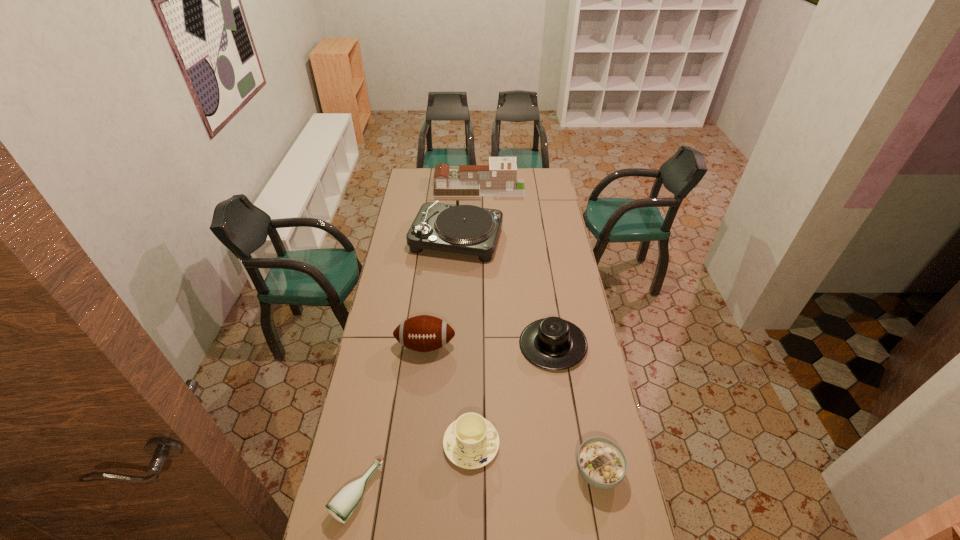
Identify the location of the farthest object. The width and height of the screenshot is (960, 540). (498, 179).

Where is `the tallest object`? The image size is (960, 540). the tallest object is located at coordinates (498, 179).

At what (x,y) coordinates should I click in order to perform the action: click on record player. Please return your answer as a coordinate pair (x, y). This screenshot has width=960, height=540. Looking at the image, I should click on (466, 229).

You are a GUI agent. You are given a task and a screenshot of the screen. Output one action in this format:
    pyautogui.click(x=<x>, y=<y>)
    Task: Click on the football
    
    Given the screenshot: What is the action you would take?
    pyautogui.click(x=423, y=333)

Identify the location of dress hat. The width and height of the screenshot is (960, 540). (552, 343).

Identify the location of chinaware. (470, 442).

Locate an element on the screen. This screenshot has width=960, height=540. the second shortest object is located at coordinates (601, 462).

Identify the location of bottle. The width and height of the screenshot is (960, 540). (342, 505).

Locate an element on the screen. This screenshot has height=540, width=960. vacant area located 0.180m at the main entrance of the tallest object is located at coordinates (554, 186).

The image size is (960, 540). In order to click on vacant space located on the back of the record player in this screenshot , I will do click(459, 210).